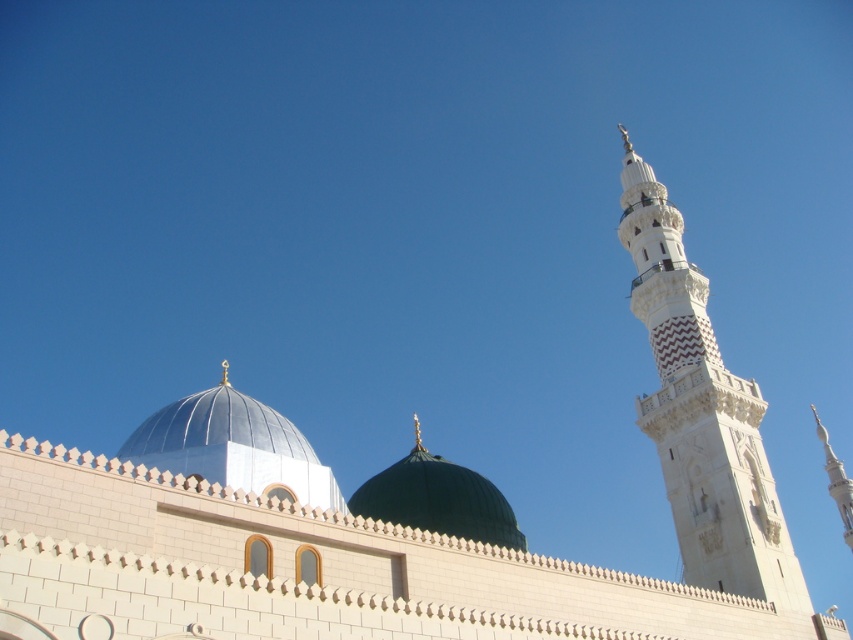
Question: Is white stone minaret at right further to camera compared to metallic silver dome at center?

Choices:
 (A) no
 (B) yes

Answer: (B)

Question: Among these objects, which one is farthest from the camera?

Choices:
 (A) white stone minaret at right
 (B) green matte dome at center
 (C) metallic silver dome at center

Answer: (A)

Question: Is metallic silver dome at center to the left of green matte dome at center from the viewer's perspective?

Choices:
 (A) yes
 (B) no

Answer: (A)

Question: Which of these objects is positioned closest to the green matte dome at center?

Choices:
 (A) metallic silver dome at center
 (B) white stone minaret at right

Answer: (A)

Question: Among these points, which one is farthest from the camera?

Choices:
 (A) (254, 464)
 (B) (459, 524)

Answer: (B)

Question: Can you confirm if white stone minaret at right is positioned to the left of green matte dome at center?

Choices:
 (A) yes
 (B) no

Answer: (B)